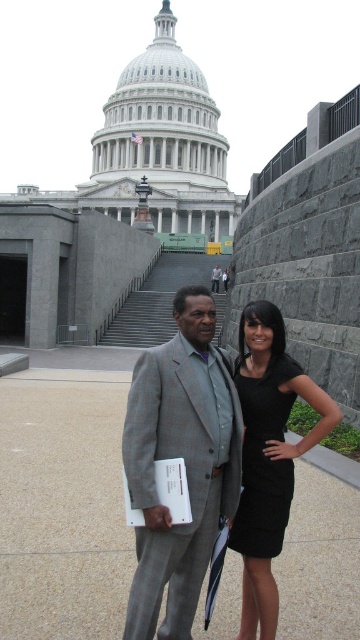
You are a photographer planning to take a group photo of the two people in front of the Capitol. Given that the gray textured suit at center and the black satin dress at center are part of their outfits, which clothing item is likely to occupy more space in the photo frame?

The gray textured suit at center might be wider than the black satin dress at center, so it is likely to occupy more space in the photo frame.

You are a photographer positioned at point (147, 563). You need to capture a photo of both the man and the woman standing in front of the United States Capitol building. Given that your camera has a maximum zoom range of 100 meters, will you be able to fit both subjects into the frame without moving your position?

The subjects are 25.64 meters apart, which is within the camera maximum zoom range of 100 meters. Therefore, you can fit both subjects into the frame without moving your position.